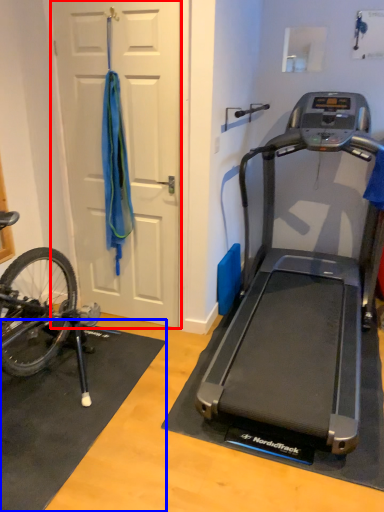
Question: Which of the following is the farthest to the observer, door (highlighted by a red box) or doormat (highlighted by a blue box)?

Choices:
 (A) door
 (B) doormat

Answer: (A)